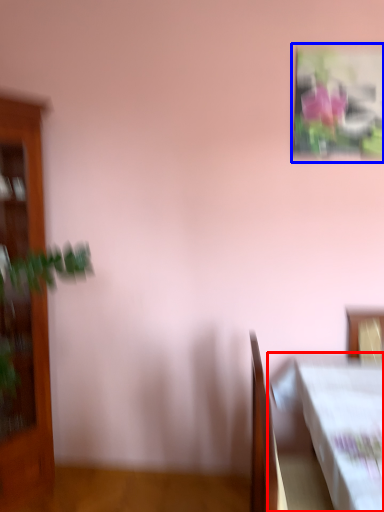
Question: Which object is further to the camera taking this photo, table (highlighted by a red box) or picture frame (highlighted by a blue box)?

Choices:
 (A) table
 (B) picture frame

Answer: (B)